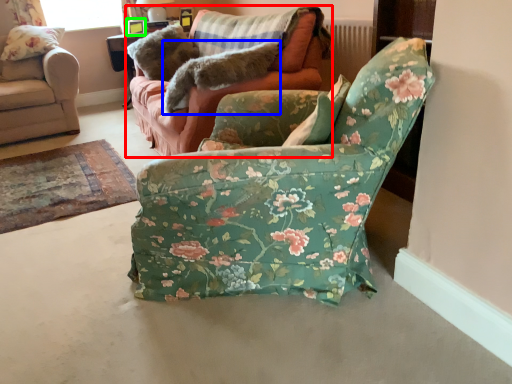
Question: Based on their relative distances, which object is nearer to studio couch (highlighted by a red box)? Choose from animal (highlighted by a blue box) and picture frame (highlighted by a green box).

Choices:
 (A) animal
 (B) picture frame

Answer: (A)